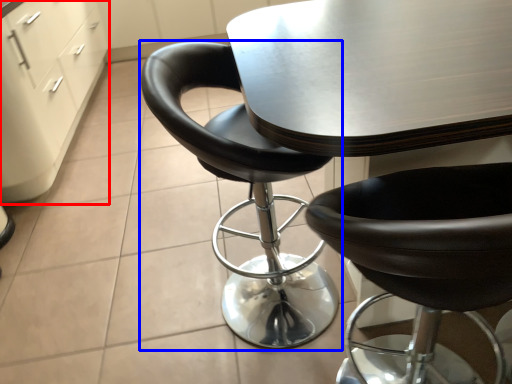
Question: Which point is closer to the camera, file cabinet (highlighted by a red box) or chair (highlighted by a blue box)?

Choices:
 (A) file cabinet
 (B) chair

Answer: (B)